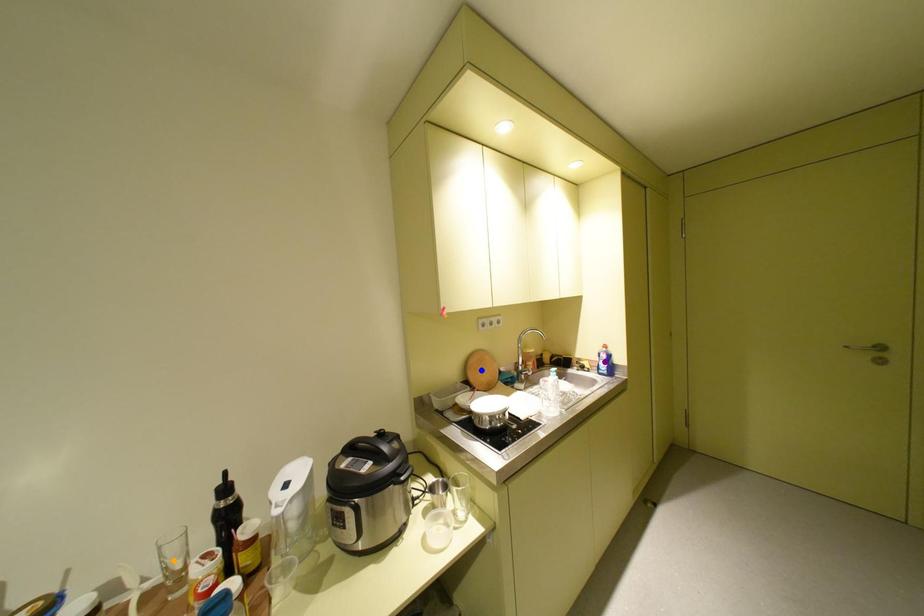
Order these from farthest to nearest:
A) blue point
B) purple point
C) orange point

purple point
blue point
orange point